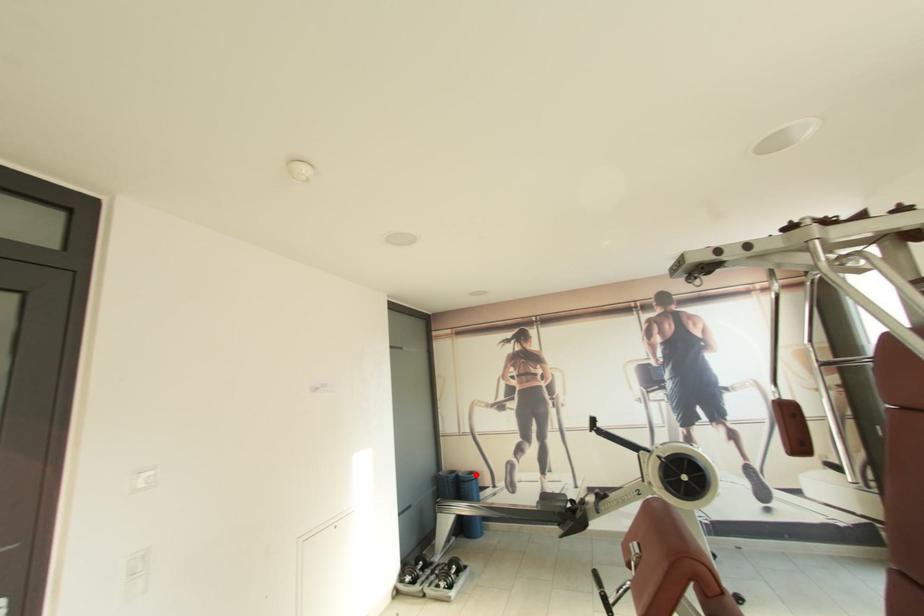
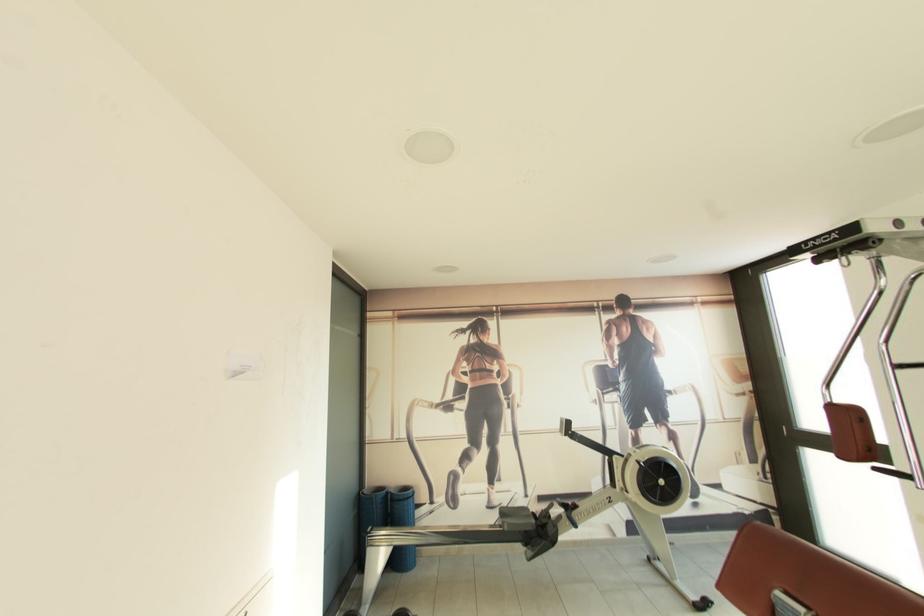
Where in the second image is the point corresponding to the highlighted location from the first image?

(410, 490)